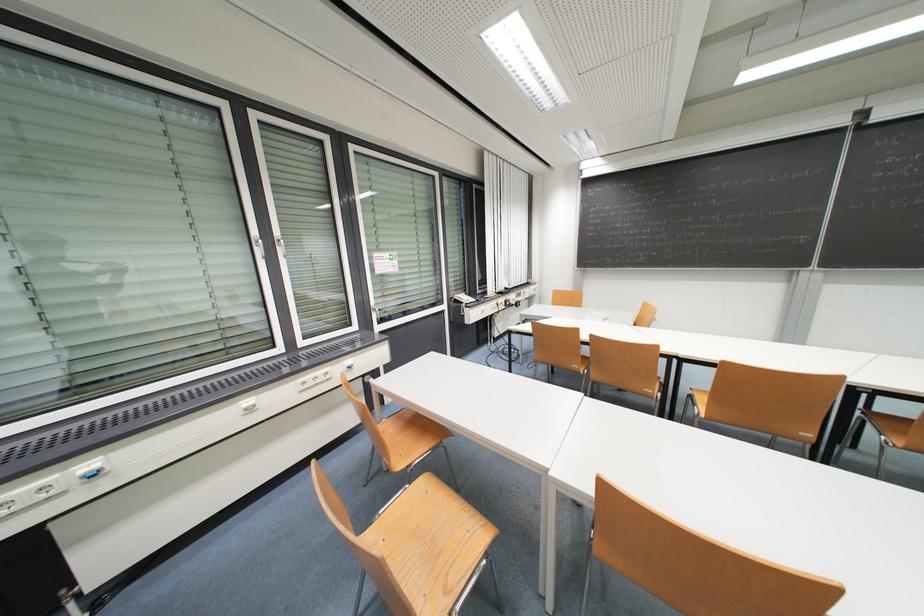
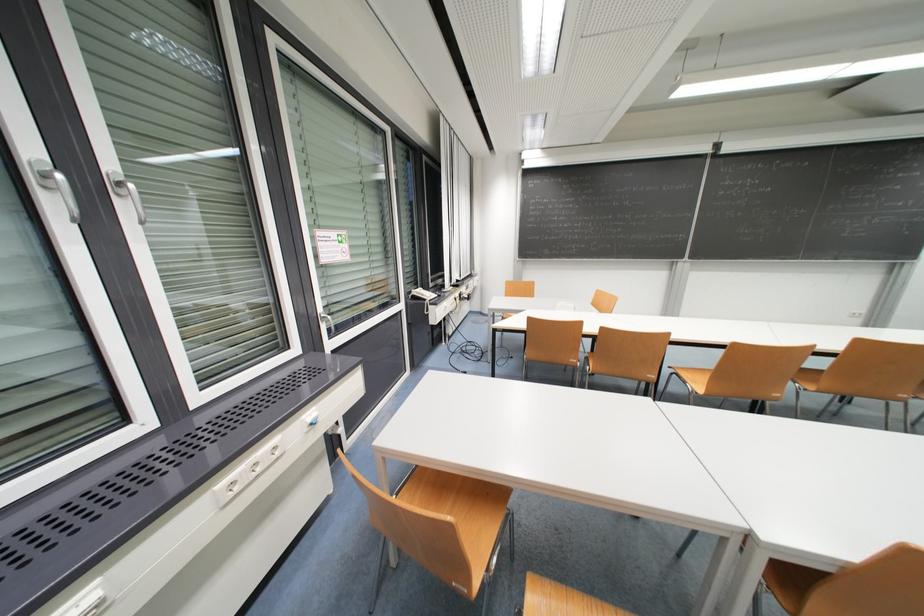
Find the pixel in the second image that matches (x=598, y=338) in the first image.

(608, 331)